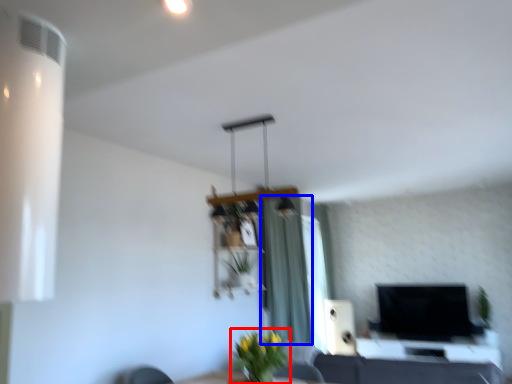
Question: Which object appears closest to the camera in this image, plant (highlighted by a red box) or curtain (highlighted by a blue box)?

Choices:
 (A) plant
 (B) curtain

Answer: (A)